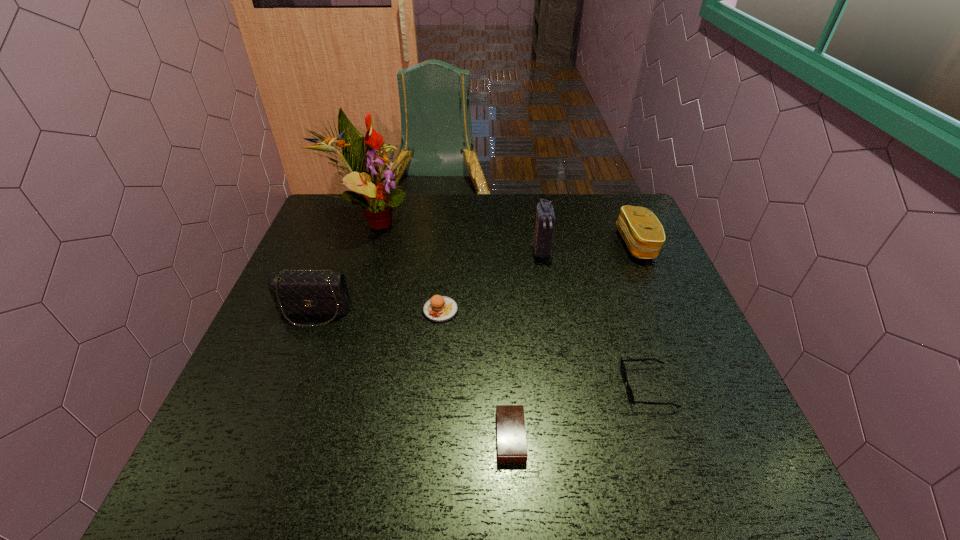
Where is `bouquet`? bouquet is located at coordinates (363, 157).

Locate an element on the screen. the tallest clutch bag is located at coordinates (545, 219).

This screenshot has width=960, height=540. I want to click on the sixth shortest object, so click(x=545, y=219).

Identify the location of the leftmost clutch bag. (295, 293).

At what (x,y) coordinates should I click in order to perform the action: click on the nearest clutch bag. Please return your answer as a coordinate pair (x, y). Image resolution: width=960 pixels, height=540 pixels. Looking at the image, I should click on (295, 293).

Identify the location of the rightmost object. (642, 232).

Find the location of `the rightmost clutch bag`. the rightmost clutch bag is located at coordinates (642, 232).

Locate an element on the screen. patty is located at coordinates click(x=438, y=309).

The height and width of the screenshot is (540, 960). In order to click on the fifth tallest object in this screenshot , I will do `click(438, 309)`.

You are a GUI agent. You are given a task and a screenshot of the screen. Output one action in this format:
    pyautogui.click(x=<x>, y=<y>)
    Task: Click on the sunglasses
    
    Given the screenshot: What is the action you would take?
    pyautogui.click(x=629, y=391)